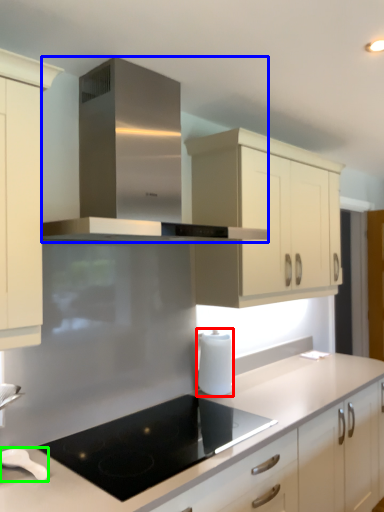
Question: Estimate the real-world distances between objects in this image. Which object is farther from kitchen appliance (highlighted by a red box), home appliance (highlighted by a blue box) or kitchen appliance (highlighted by a green box)?

Choices:
 (A) home appliance
 (B) kitchen appliance

Answer: (A)